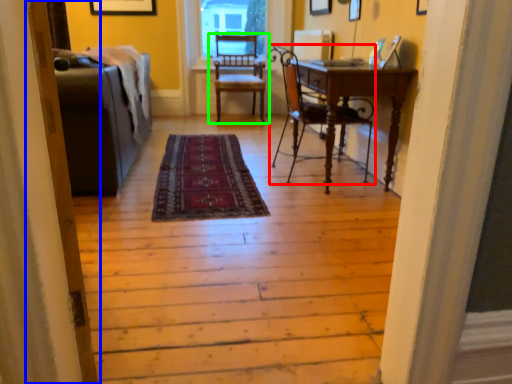
Question: Which object is positioned closest to chair (highlighted by a red box)? Select from screen door (highlighted by a blue box) and chair (highlighted by a green box).

Choices:
 (A) screen door
 (B) chair

Answer: (B)